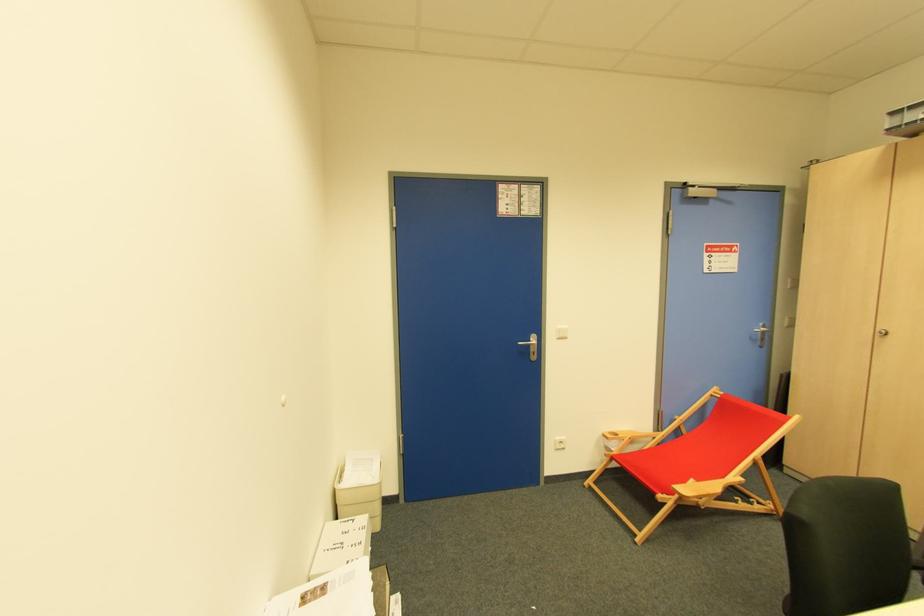
Where is `white light switch`? white light switch is located at coordinates (560, 442).